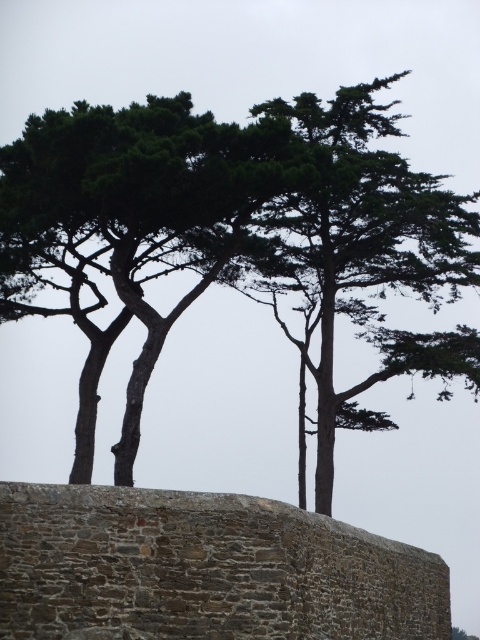
You are a landscape architect designing a walking path between the green textured tree at upper center and the green textured tree at center. What is the minimum width your path should be to ensure visitors can comfortably walk between them?

The distance between the green textured tree at upper center and the green textured tree at center is 8.49 meters, so the path should be at least 8.49 meters wide to allow visitors to comfortably walk between them.

You are standing in front of the brown stone wall at center and the green textured tree at center. Which object is larger in size?

The brown stone wall at center has a smaller size compared to the green textured tree at center, so the green textured tree at center is larger.